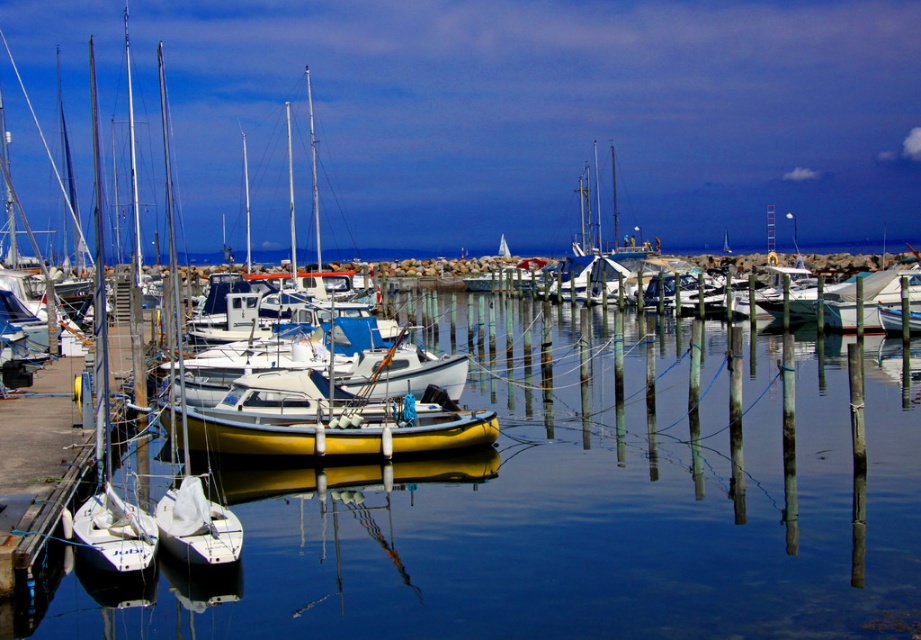
Is the position of transparent water at center less distant than that of white matte sailboat at center?

Yes, transparent water at center is closer to the viewer.

Which is in front, point (286, 545) or point (847, 301)?

Positioned in front is point (286, 545).

You are a GUI agent. You are given a task and a screenshot of the screen. Output one action in this format:
    pyautogui.click(x=<x>, y=<y>)
    Task: Click on the transparent water at center
    This screenshot has height=640, width=921.
    Given the screenshot: What is the action you would take?
    pyautogui.click(x=576, y=509)

Can you confirm if yellow matte sailboat at center is bigger than white matte sailboat at center?

Incorrect, yellow matte sailboat at center is not larger than white matte sailboat at center.

Is point (318, 353) in front of point (852, 332)?

Yes, point (318, 353) is in front of point (852, 332).

Is point (387, 388) less distant than point (855, 316)?

That is True.

Where is `yellow matte sailboat at center`? yellow matte sailboat at center is located at coordinates (248, 364).

Does transparent water at center appear on the left side of yellow matte sailboat at center?

In fact, transparent water at center is to the right of yellow matte sailboat at center.

Identify the location of transparent water at center. Image resolution: width=921 pixels, height=640 pixels. (576, 509).

Where is `transparent water at center`? transparent water at center is located at coordinates (576, 509).